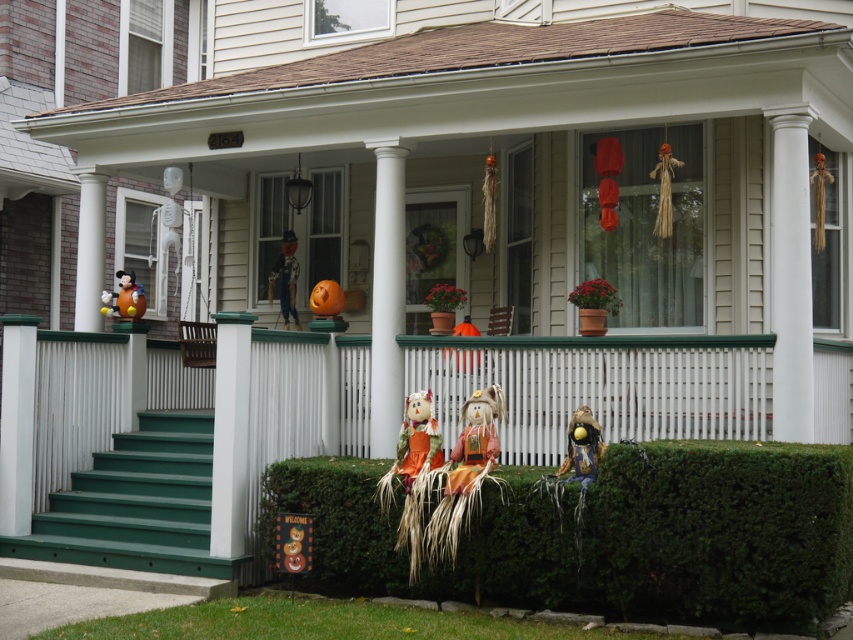
You are standing at the bottom of the green painted wood stairs at lower left and want to walk up to the porch. Is the orange fabric scarecrow at center blocking your path?

The orange fabric scarecrow at center is behind the green painted wood stairs at lower left, so it is not blocking your path. You can walk up the stairs without any obstruction.

You are planning to place a new Halloween decoration that is 3 feet wide on the porch. The green textured hedge at lower center and the orange fabric scarecrow at center are already there. Which object can accommodate the decoration in terms of width?

The green textured hedge at lower center has a larger width than the orange fabric scarecrow at center, so the decoration can be placed near the green textured hedge at lower center.